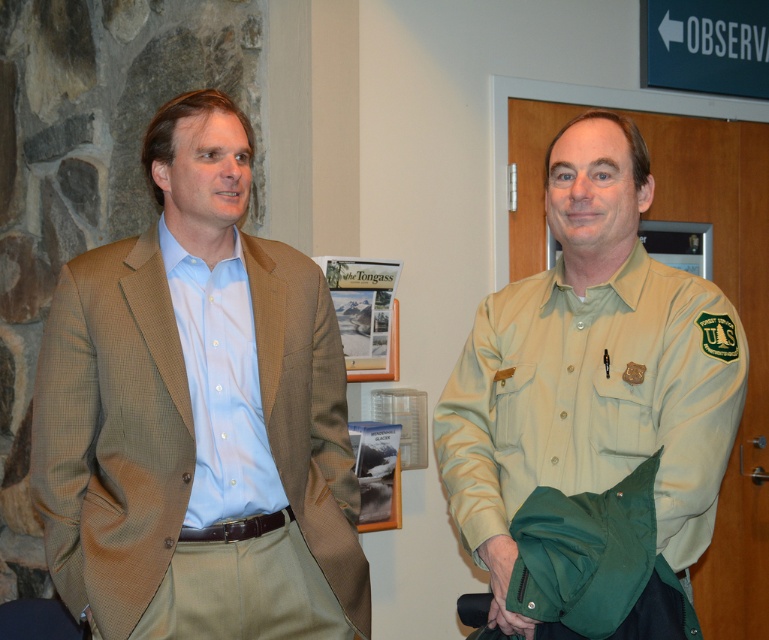
Question: Is light brown textured blazer at left closer to camera compared to khaki uniform shirt at right?

Choices:
 (A) no
 (B) yes

Answer: (A)

Question: Among these objects, which one is nearest to the camera?

Choices:
 (A) light brown textured blazer at left
 (B) khaki uniform shirt at right

Answer: (B)

Question: Can you confirm if light brown textured blazer at left is positioned to the right of khaki uniform shirt at right?

Choices:
 (A) yes
 (B) no

Answer: (B)

Question: Can you confirm if light brown textured blazer at left is positioned below khaki uniform shirt at right?

Choices:
 (A) no
 (B) yes

Answer: (B)